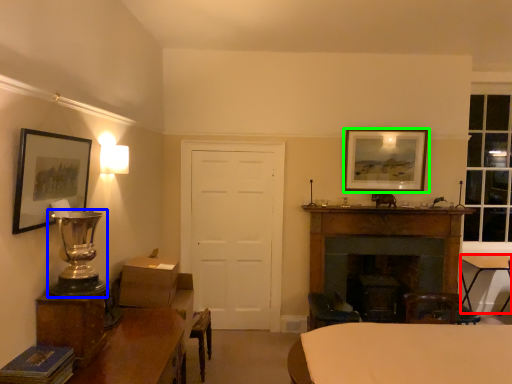
Question: Which object is positioned closest to table (highlighted by a red box)? Select from table lamp (highlighted by a blue box) and picture frame (highlighted by a green box).

Choices:
 (A) table lamp
 (B) picture frame

Answer: (B)